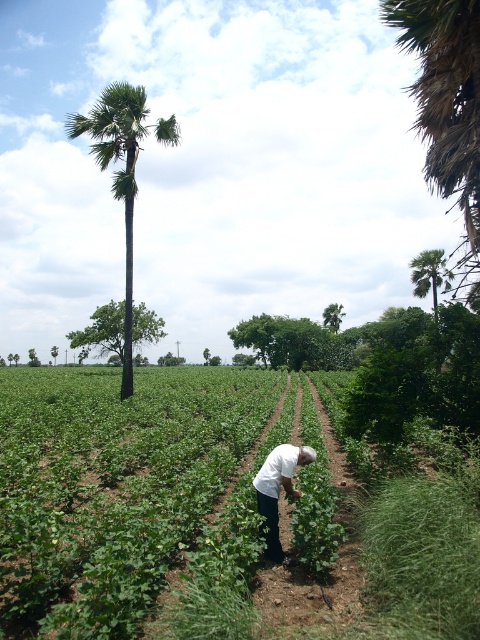
Does green leafy tree at center have a lesser height compared to green leafy palm tree at right?

In fact, green leafy tree at center may be taller than green leafy palm tree at right.

Describe the element at coordinates (103, 330) in the screenshot. I see `green leafy tree at center` at that location.

Is point (122, 346) more distant than point (444, 264)?

That is True.

At what (x,y) coordinates should I click in order to perform the action: click on green leafy tree at center. Please return your answer as a coordinate pair (x, y). The image size is (480, 640). Looking at the image, I should click on (103, 330).

Does green leafy plants at center come in front of white cotton shirt at center?

Yes, it is.

Is green leafy plants at center bigger than white cotton shirt at center?

Yes.

Between point (253, 376) and point (272, 531), which one is positioned behind?

The point (253, 376) is more distant.

Image resolution: width=480 pixels, height=640 pixels. I want to click on green leafy plants at center, so click(x=132, y=499).

Does white cotton shirt at center have a smaller size compared to green leafy palm tree at right?

Yes.

Who is higher up, white cotton shirt at center or green leafy palm tree at right?

green leafy palm tree at right

I want to click on white cotton shirt at center, so click(277, 490).